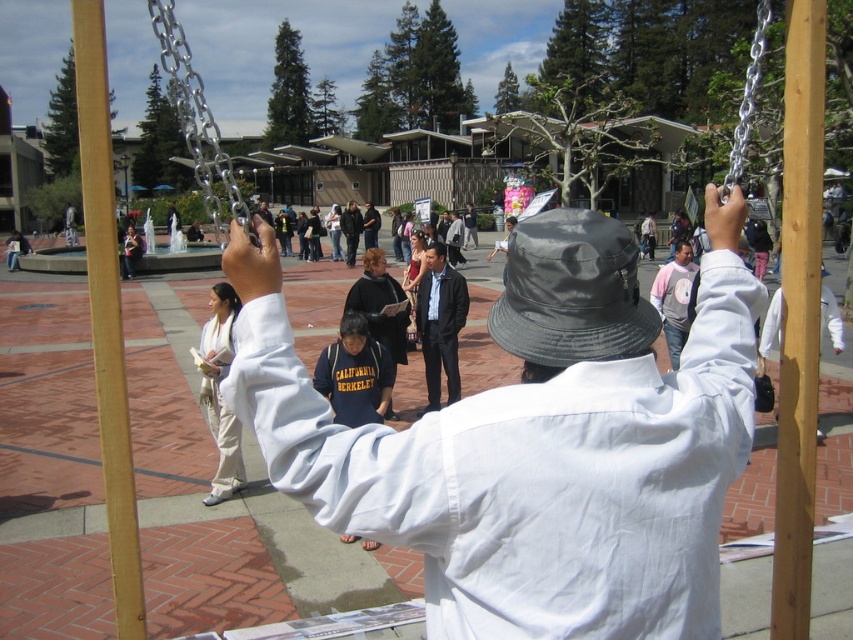
You are standing at the center of the plaza and want to locate the wooden pole at left. In which direction should you look to see it?

The wooden pole at left is located at point 0.492 on the x axis and 0.125 on the y axis. Since you are at the center, you should look to the left side to find the wooden pole at left.

You are a photographer trying to capture both the white cotton robe at lower left and the pink cotton shirt at upper center in a single frame. Given their sizes, which one might you need to position closer to the camera to ensure both fit well in the photo?

The white cotton robe at lower left is wider than the pink cotton shirt at upper center. To ensure both fit well in the photo, you should position the white cotton robe at lower left closer to the camera since its larger size requires more space in the frame.

You are a photographer trying to capture a wide shot of the wooden pole at left and the dark blue fleece jacket at center. Which object will appear wider in the photo?

The wooden pole at left will appear wider in the photo since its width surpasses that of the dark blue fleece jacket at center.